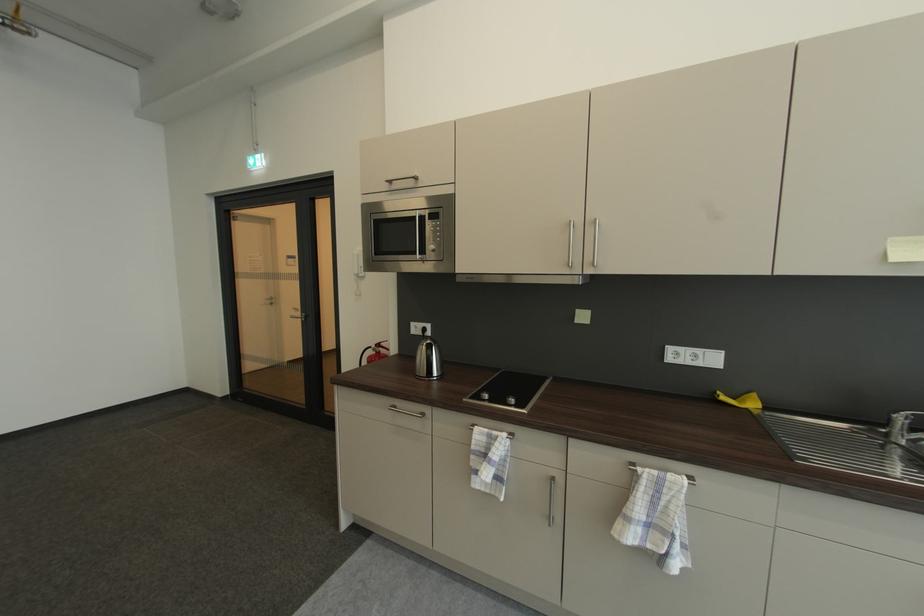
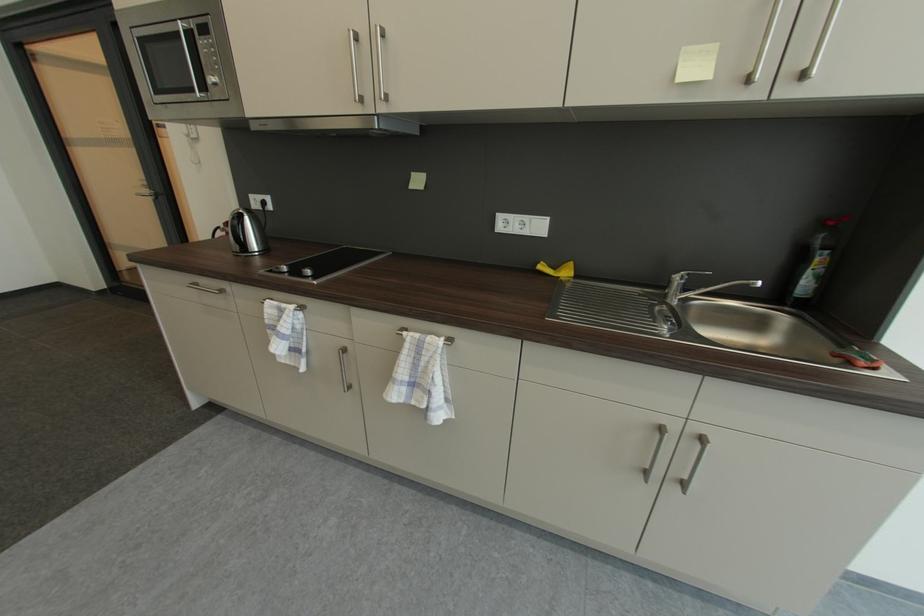
Question: The images are taken continuously from a first-person perspective. In which direction are you moving?

Choices:
 (A) Left
 (B) Right
 (C) Forward
 (D) Backward

Answer: (B)